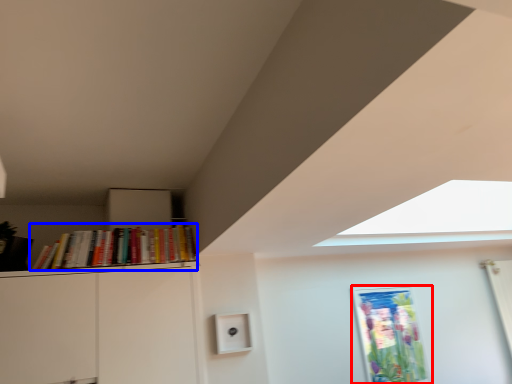
Question: Which of the following is the closest to the observer, picture frame (highlighted by a red box) or book (highlighted by a blue box)?

Choices:
 (A) picture frame
 (B) book

Answer: (B)